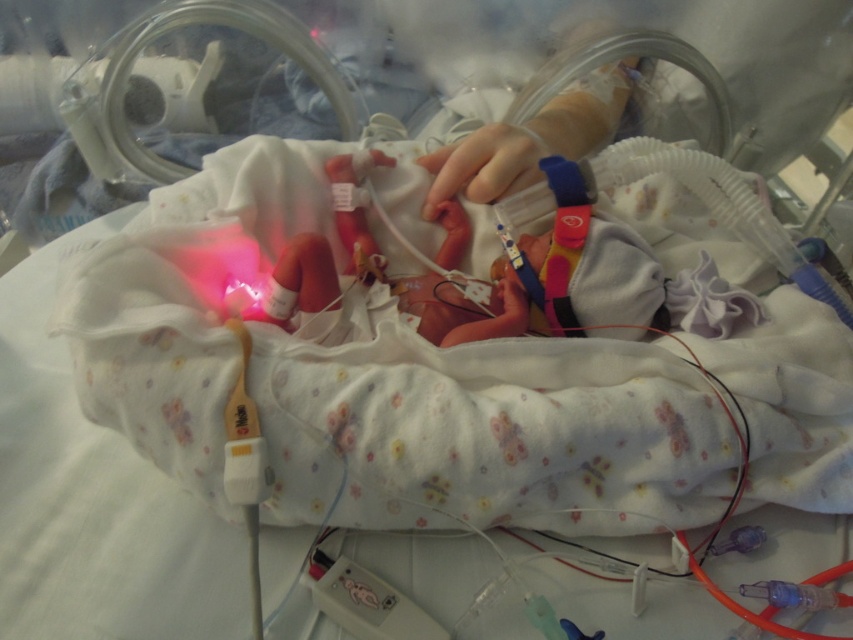
Does smooth skin newborn at center come in front of smooth skin hand at center?

Yes, it is in front of smooth skin hand at center.

Is smooth skin newborn at center behind smooth skin hand at center?

No, smooth skin newborn at center is closer to the viewer.

Who is more distant from viewer, (534, 314) or (500, 168)?

Positioned behind is point (500, 168).

Where is `smooth skin newborn at center`? The width and height of the screenshot is (853, 640). smooth skin newborn at center is located at coordinates (575, 266).